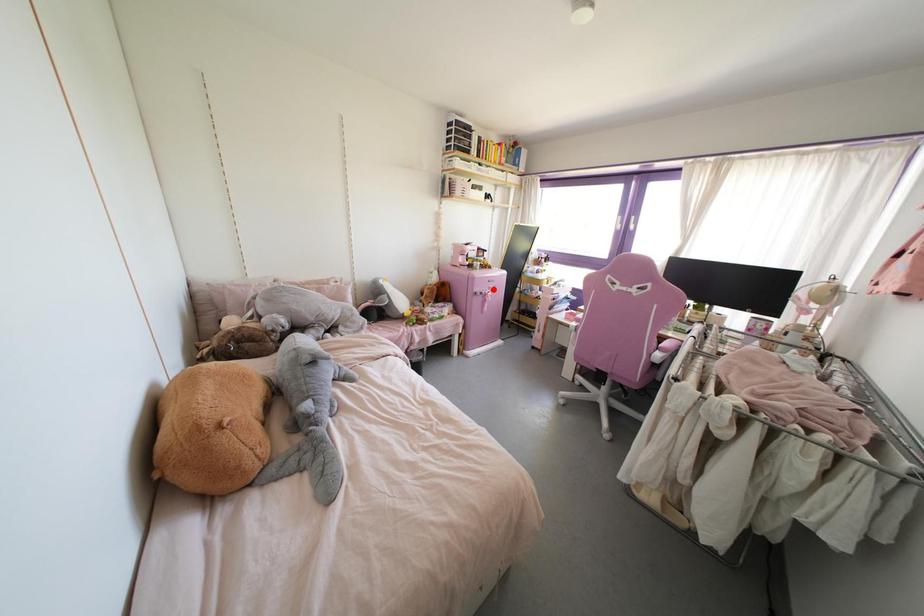
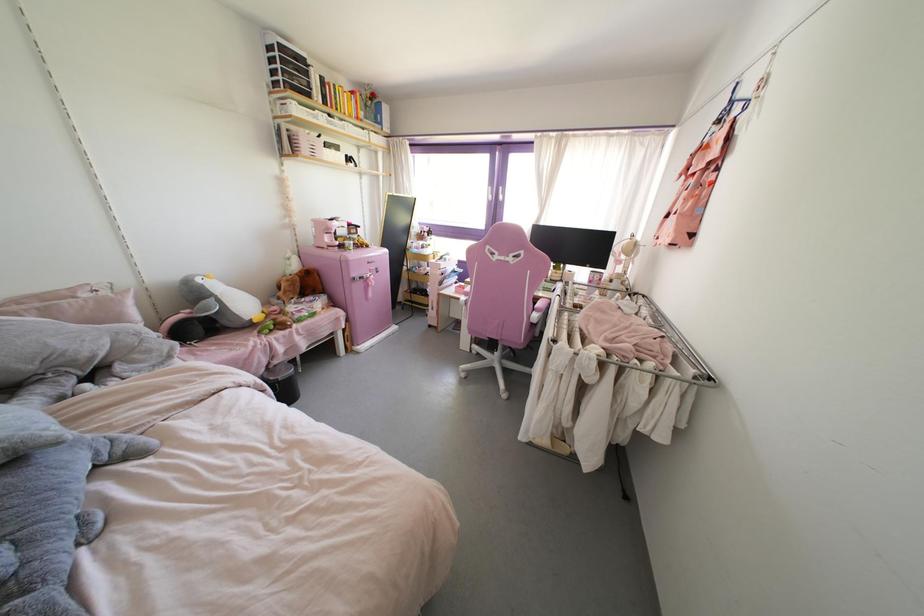
Question: I am providing you with two images of the same scene from different viewpoints. Image1 has a red point marked. In image2, the corresponding 3D location appears at what relative position? Reply with the corresponding letter.

Choices:
 (A) Closer
 (B) Farther

Answer: (A)